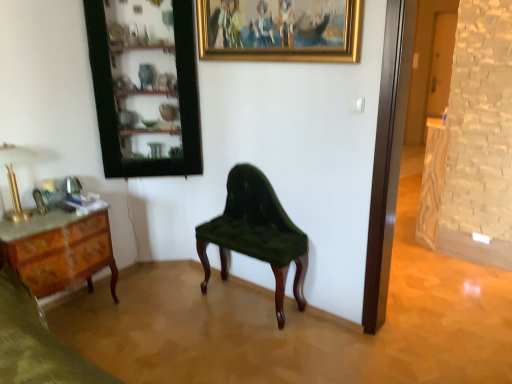
Locate an element on the screen. free point to the right of marble top wood desk at left is located at coordinates [x=136, y=317].